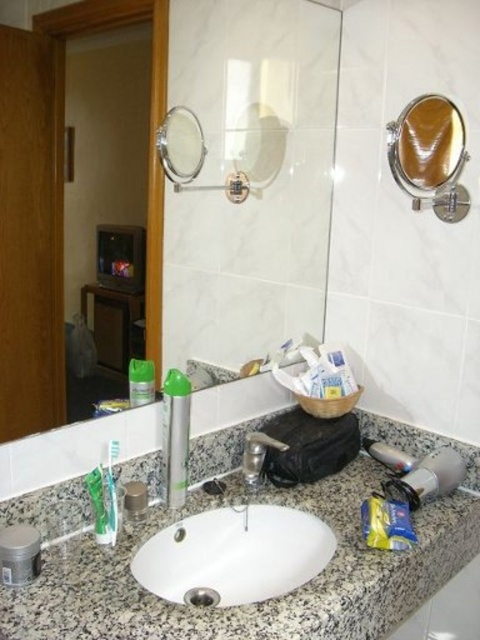
You are a delivery person who just arrived at the bathroom and need to place a new package that is 1.5 meters long. The package must be placed horizontally between the satin gold mirror at upper right and the camera. Is there enough space for the package?

The distance between the satin gold mirror at upper right and the camera is 1.29 meters, which is shorter than the package length of 1.5 meters. Therefore, the package cannot be placed horizontally in this space.

You are organizing the bathroom vanity and need to access the silver metallic magnifying mirror at upper left. Is the matte black cabinet at left blocking your view of the mirror?

Yes, the matte black cabinet at left is in front of the silver metallic magnifying mirror at upper left, so it is blocking the view of the mirror.

You are organizing your bathroom and need to place a new 12x12 inch decorative plate. The matte black cabinet at left and the silver metallic magnifying mirror at upper left are both potential spots. Which object can accommodate the plate without it overhanging?

The matte black cabinet at left has a larger size compared to the silver metallic magnifying mirror at upper left, so the decorative plate can fit on the matte black cabinet at left without overhanging.